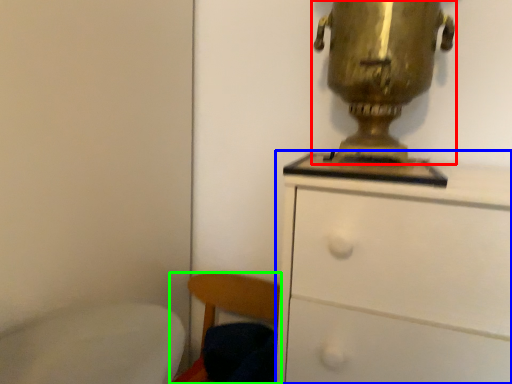
Question: Considering the real-world distances, which object is closest to table lamp (highlighted by a red box)? chest of drawers (highlighted by a blue box) or chair (highlighted by a green box).

Choices:
 (A) chest of drawers
 (B) chair

Answer: (A)